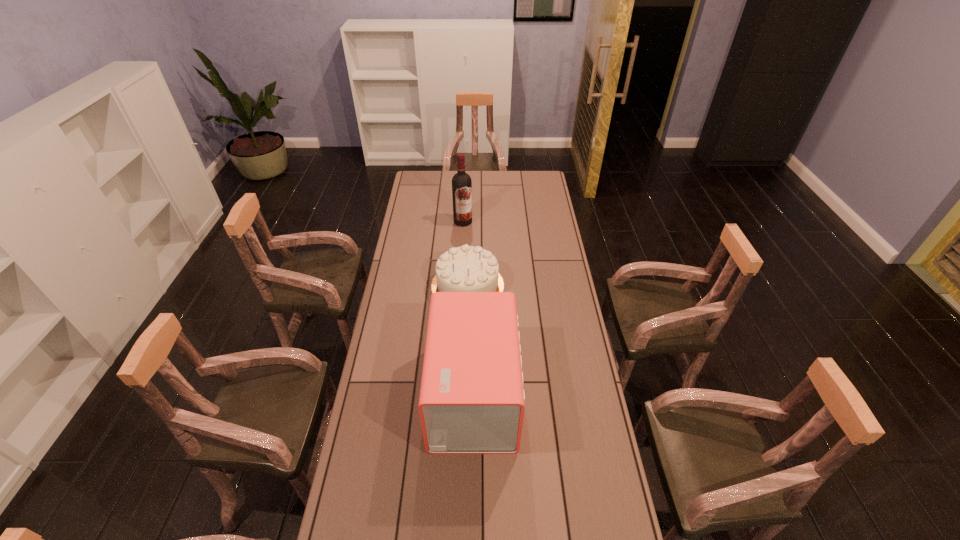
The image size is (960, 540). Identify the location of the farthest object. (461, 182).

At what (x,y) coordinates should I click in order to perform the action: click on wine bottle. Please return your answer as a coordinate pair (x, y). The image size is (960, 540). Looking at the image, I should click on (461, 182).

This screenshot has width=960, height=540. In order to click on box in this screenshot , I will do `click(471, 401)`.

At what (x,y) coordinates should I click in order to perform the action: click on the nearest object. Please return your answer as a coordinate pair (x, y). The height and width of the screenshot is (540, 960). Looking at the image, I should click on [x=471, y=401].

The image size is (960, 540). Identify the location of the shortest object. tap(466, 268).

Find the location of `the second nearest object`. the second nearest object is located at coordinates (466, 268).

Identify the location of free space located 0.320m on the label of the wine bottle. (461, 268).

Where is `vacant space situated on the surface of the nearest object where the text is embossed`? This screenshot has width=960, height=540. vacant space situated on the surface of the nearest object where the text is embossed is located at coordinates (570, 394).

You are a GUI agent. You are given a task and a screenshot of the screen. Output one action in this format:
    pyautogui.click(x=<x>, y=<y>)
    Task: Click on the free space located 0.360m on the front of the second farthest object
    
    Given the screenshot: What is the action you would take?
    pyautogui.click(x=465, y=385)

Locate an element on the screen. Image resolution: width=960 pixels, height=540 pixels. vacant region at the far edge of the desktop is located at coordinates (497, 185).